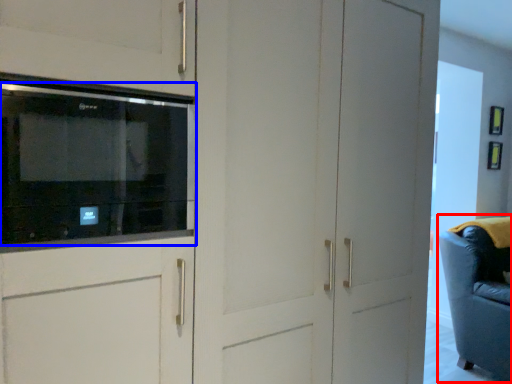
Question: Which object is further to the camera taking this photo, swivel chair (highlighted by a red box) or microwave oven (highlighted by a blue box)?

Choices:
 (A) swivel chair
 (B) microwave oven

Answer: (A)